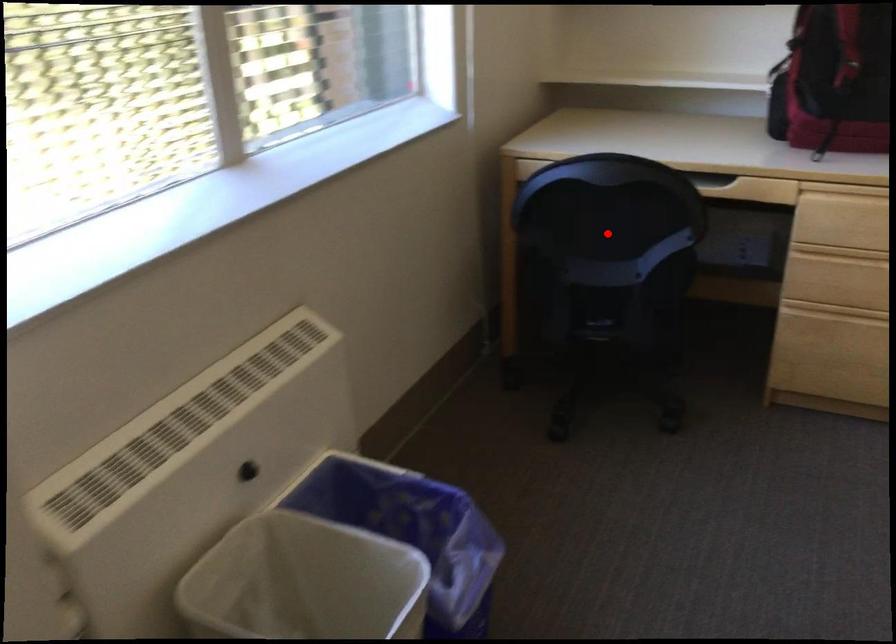
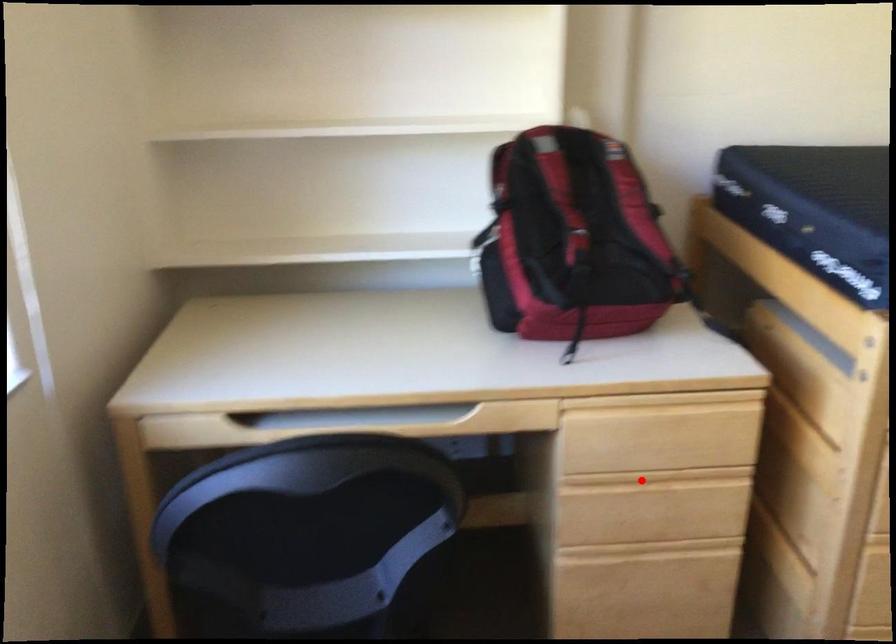
I am providing you with two images of the same scene from different viewpoints. A red point is marked on the first image and another point is marked on the second image. Is the marked point in image1 the same physical position as the marked point in image2?

No